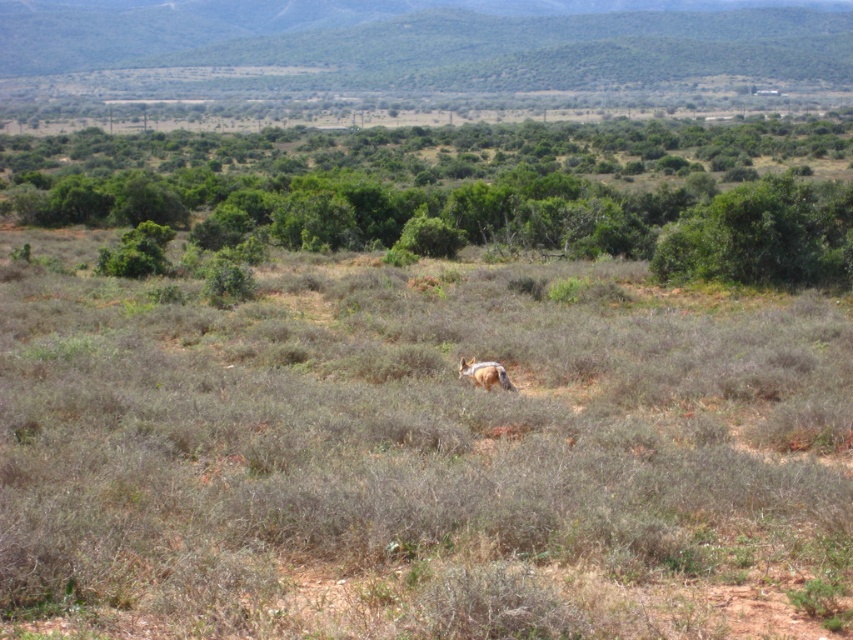
Is point (416, 184) closer to camera compared to point (479, 380)?

No, (416, 184) is further to viewer.

Who is more forward, (802, 172) or (498, 387)?

Point (498, 387) is in front.

The image size is (853, 640). What do you see at coordinates (463, 193) in the screenshot? I see `green leafy shrubs at upper center` at bounding box center [463, 193].

Where is `green leafy shrubs at upper center`? green leafy shrubs at upper center is located at coordinates (463, 193).